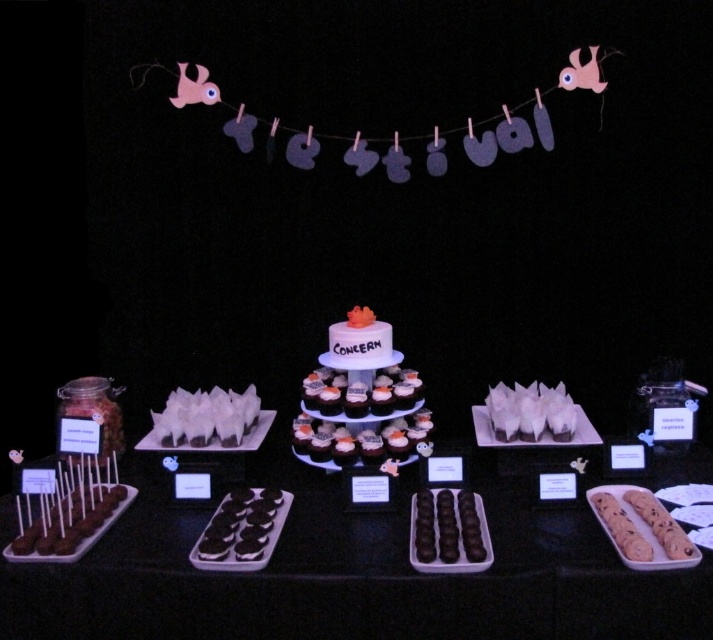
Question: In this image, where is white matte tiered cake at center located relative to chocolate cookie at center?

Choices:
 (A) left
 (B) right

Answer: (B)

Question: Does chocolate cake at center lie behind chocolate-dipped chocolate at lower left?

Choices:
 (A) yes
 (B) no

Answer: (B)

Question: Which point is closer to the camera?

Choices:
 (A) chocolate cake at center
 (B) white matte tiered cake at center

Answer: (A)

Question: Which point appears closest to the camera in this image?

Choices:
 (A) (421, 513)
 (B) (492, 428)
 (C) (128, 492)
 (D) (337, 406)

Answer: (A)

Question: Can you confirm if chocolate matte cake at center is smaller than chocolate cake at center?

Choices:
 (A) yes
 (B) no

Answer: (A)

Question: Which point is farther to the camera?

Choices:
 (A) white paper cups at center
 (B) chocolate-dipped chocolate at lower left
 (C) smooth chocolate truffles at center
 (D) chocolate cake at center

Answer: (A)